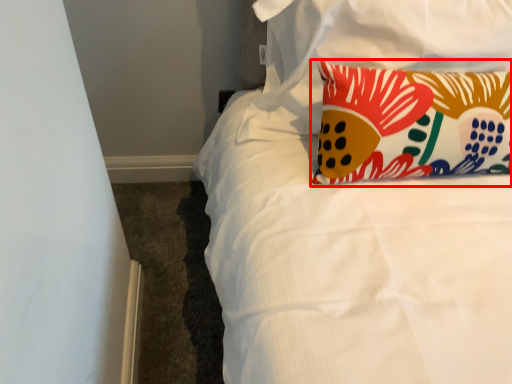
Question: From the image's perspective, what is the correct spatial relationship of pillow (annotated by the red box) in relation to pillow?

Choices:
 (A) below
 (B) above

Answer: (A)